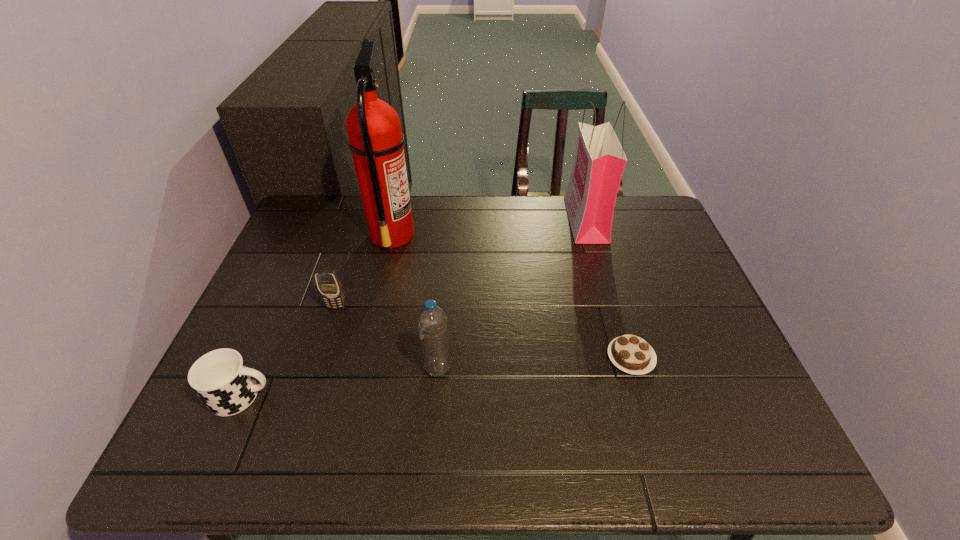
You are a GUI agent. You are given a task and a screenshot of the screen. Output one action in this format:
    pyautogui.click(x=<x>, y=<y>)
    Task: Click on the fourth object from right to left
    The image size is (960, 540).
    Given the screenshot: What is the action you would take?
    pyautogui.click(x=375, y=138)

Where is `fire extinguisher`? The image size is (960, 540). fire extinguisher is located at coordinates (375, 138).

Locate an element on the screen. Image resolution: width=960 pixels, height=540 pixels. the second tallest object is located at coordinates (599, 162).

You are a GUI agent. You are given a task and a screenshot of the screen. Output one action in this format:
    pyautogui.click(x=<x>, y=<y>)
    Task: Click on the third object from right to left
    
    Given the screenshot: What is the action you would take?
    pyautogui.click(x=432, y=322)

In order to click on water bottle in this screenshot , I will do `click(432, 322)`.

In order to click on the fourth nearest object in this screenshot , I will do `click(329, 285)`.

Where is `cellular telephone`? The image size is (960, 540). cellular telephone is located at coordinates (329, 285).

Identify the location of the second shortest object. (221, 378).

I want to click on cup, so click(221, 378).

Locate an element on the screen. The height and width of the screenshot is (540, 960). chocolate cake is located at coordinates (631, 354).